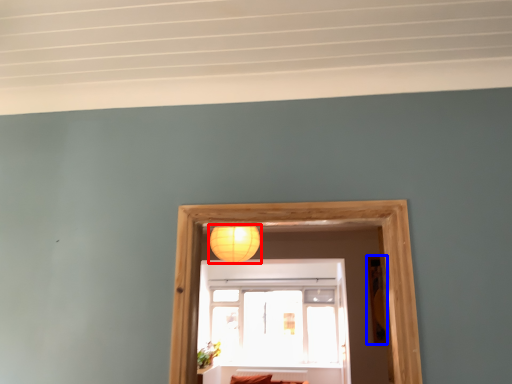
Question: Which of the following is the farthest to the observer, lamp (highlighted by a red box) or picture frame (highlighted by a blue box)?

Choices:
 (A) lamp
 (B) picture frame

Answer: (B)